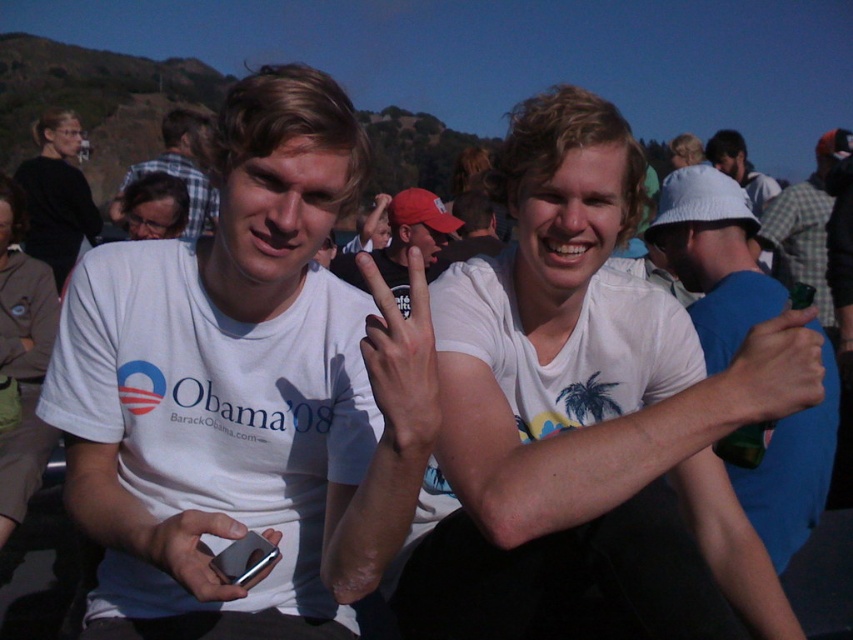
Question: Which object is closer to the camera taking this photo?

Choices:
 (A) matte black glasses at upper left
 (B) plaid shirt at center
 (C) green plastic bottle at right

Answer: (B)

Question: Does white matte t-shirt at center appear under white cotton hat at upper right?

Choices:
 (A) no
 (B) yes

Answer: (B)

Question: Considering the relative positions of brown suede jacket at upper left and plaid shirt at center in the image provided, where is brown suede jacket at upper left located with respect to plaid shirt at center?

Choices:
 (A) right
 (B) left

Answer: (A)

Question: Estimate the real-world distances between objects in this image. Which object is closer to the green plastic bottle at right?

Choices:
 (A) plaid shirt at center
 (B) white cotton hat at upper right

Answer: (B)

Question: Which point is farther to the camera?

Choices:
 (A) white cotton hat at upper right
 (B) brown suede jacket at upper left

Answer: (A)

Question: Is white matte hat at upper right thinner than silver metallic smartphone at lower center?

Choices:
 (A) no
 (B) yes

Answer: (A)